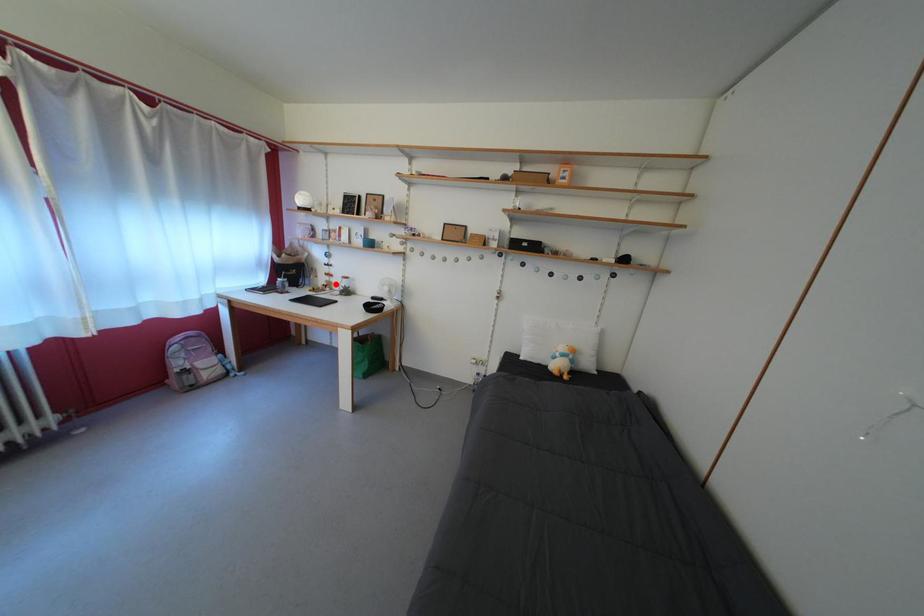
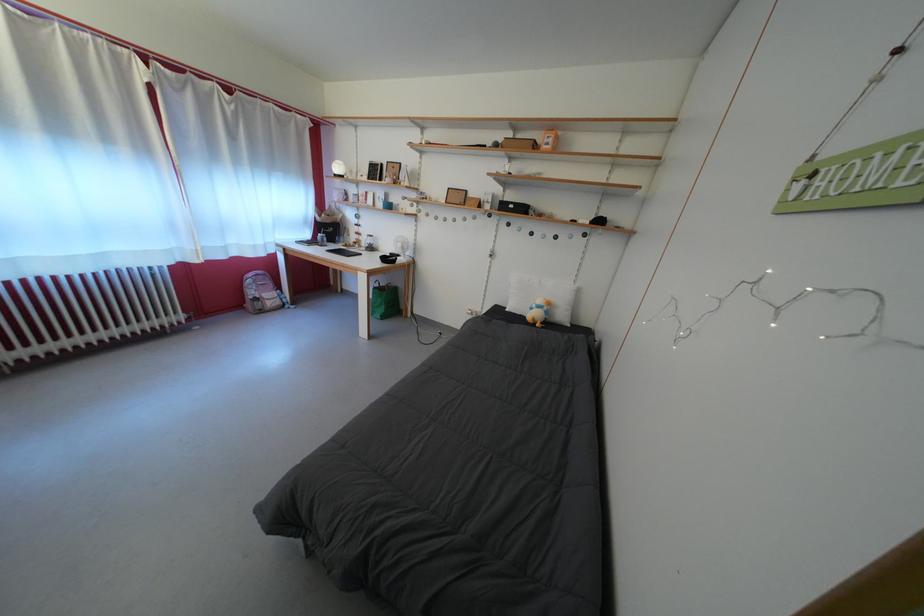
The point at the highlighted location is marked in the first image. Where is the corresponding point in the second image?

(365, 243)